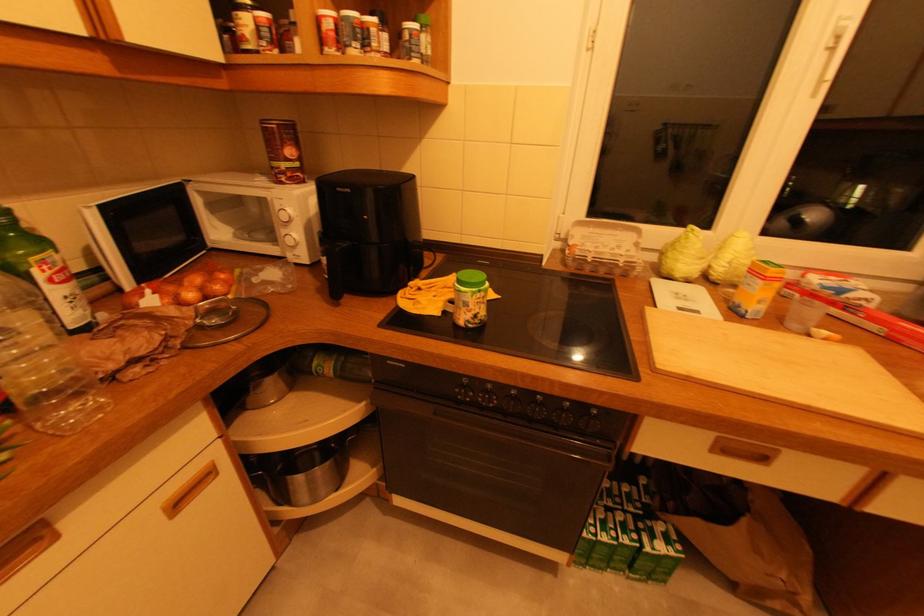
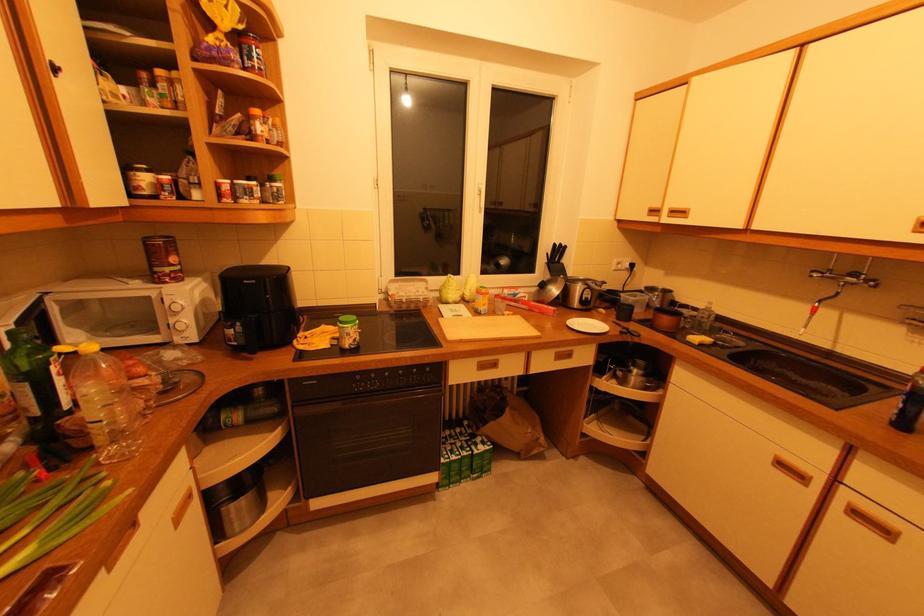
Find the pixel in the second image that matches point (294, 153) in the first image.

(176, 260)